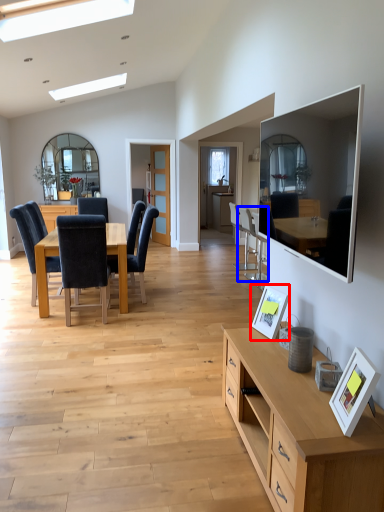
Question: Which of the following is the farthest to the observer, picture frame (highlighted by a red box) or chair (highlighted by a blue box)?

Choices:
 (A) picture frame
 (B) chair

Answer: (B)